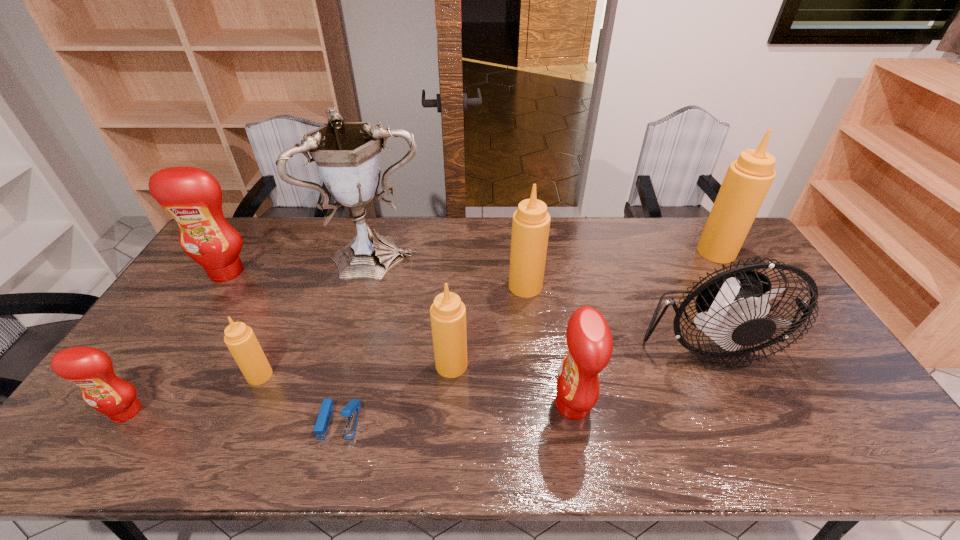
At what (x,y) coordinates should I click in order to perform the action: click on trophy cup. Please return your answer as a coordinate pair (x, y). The width and height of the screenshot is (960, 540). Looking at the image, I should click on (347, 154).

Locate an element on the screen. This screenshot has width=960, height=540. the farthest tan condiment is located at coordinates (747, 181).

Find the location of a particular element. The width and height of the screenshot is (960, 540). the tallest condiment is located at coordinates (747, 181).

Where is `the second biggest tan condiment`? the second biggest tan condiment is located at coordinates (531, 222).

Find the location of a particular element. Image resolution: width=960 pixels, height=540 pixels. the second tan condiment from right to left is located at coordinates tap(531, 222).

The image size is (960, 540). What are the coordinates of `the biggest red condiment` in the screenshot? It's located at [x=193, y=197].

Identify the location of fan. (732, 305).

Locate an element on the screen. the second smallest tan condiment is located at coordinates (448, 313).

The image size is (960, 540). I want to click on the fifth object from right to left, so click(448, 313).

Locate an element on the screen. The image size is (960, 540). the second biggest red condiment is located at coordinates [589, 339].